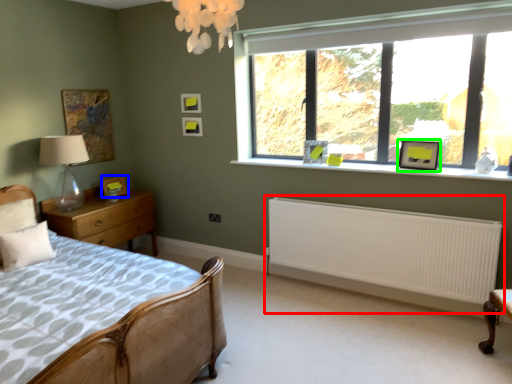
Question: Estimate the real-world distances between objects in this image. Which object is farther from radiator (highlighted by a red box), picture frame (highlighted by a blue box) or picture frame (highlighted by a green box)?

Choices:
 (A) picture frame
 (B) picture frame

Answer: (A)